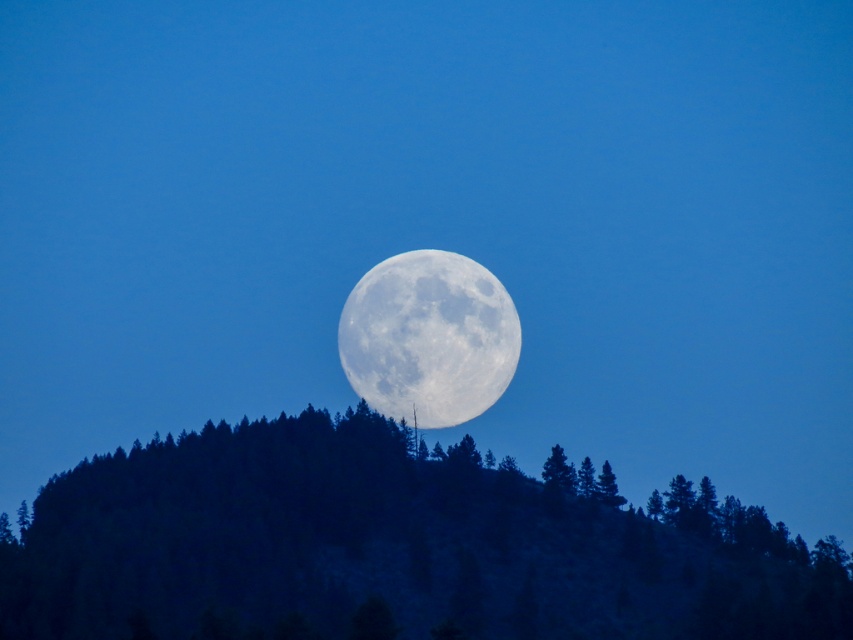
Find the location of a particular element. green textured tree at upper center is located at coordinates (389, 548).

Can you confirm if green textured tree at upper center is positioned to the right of white textured moon at center?

Yes, green textured tree at upper center is to the right of white textured moon at center.

Who is more forward, (148,600) or (445,401)?

Point (148,600) is in front.

The width and height of the screenshot is (853, 640). I want to click on green textured tree at upper center, so click(389, 548).

Is white textured moon at center taller than green matte tree at center?

Correct, white textured moon at center is much taller as green matte tree at center.

What do you see at coordinates (428, 337) in the screenshot? I see `white textured moon at center` at bounding box center [428, 337].

Find the location of a particular element. white textured moon at center is located at coordinates (428, 337).

Can you confirm if green matte tree at center is wider than green matte tree at upper right?

No.

I want to click on green matte tree at center, so tap(558, 472).

Is point (567, 467) closer to camera compared to point (598, 481)?

No, (567, 467) is further to viewer.

Locate an element on the screen. green matte tree at center is located at coordinates click(x=558, y=472).